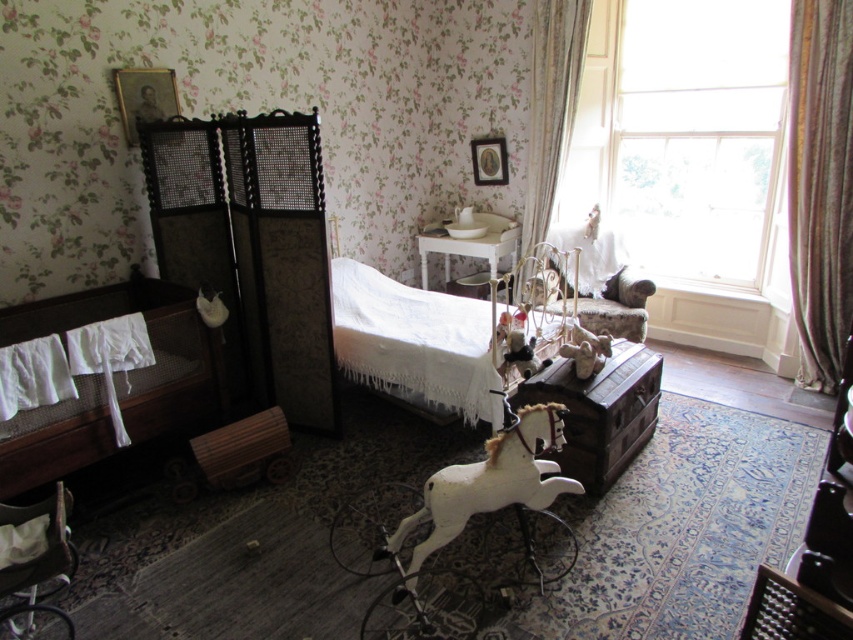
Question: Is transparent glass window at upper right to the right of wooden angel at center from the viewer's perspective?

Choices:
 (A) no
 (B) yes

Answer: (B)

Question: Which is farther from the white glossy table at center?

Choices:
 (A) silky beige curtain at right
 (B) white plastic baby carriage at lower left
 (C) white wooden baby carriage at center
 (D) floral fabric curtain at right

Answer: (B)

Question: Which of the following is the farthest from the observer?

Choices:
 (A) white plastic baby carriage at lower left
 (B) wooden angel at center
 (C) floral fabric curtain at right

Answer: (C)

Question: Is transparent glass window at upper right above white plastic baby carriage at lower left?

Choices:
 (A) yes
 (B) no

Answer: (A)

Question: Which of the following is the farthest from the observer?

Choices:
 (A) (564, 145)
 (B) (55, 577)

Answer: (A)

Question: Can you confirm if floral fabric curtain at right is positioned above white glossy table at center?

Choices:
 (A) yes
 (B) no

Answer: (A)